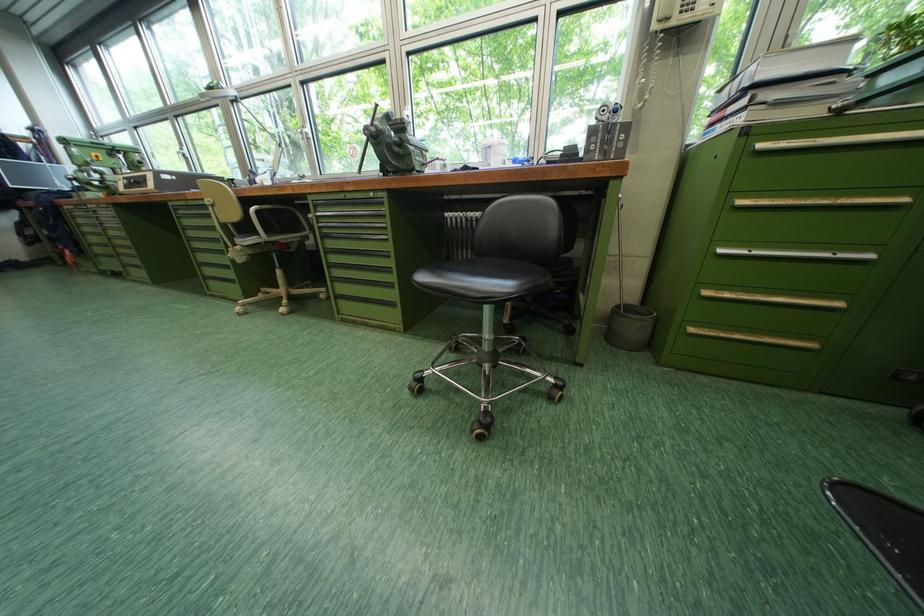
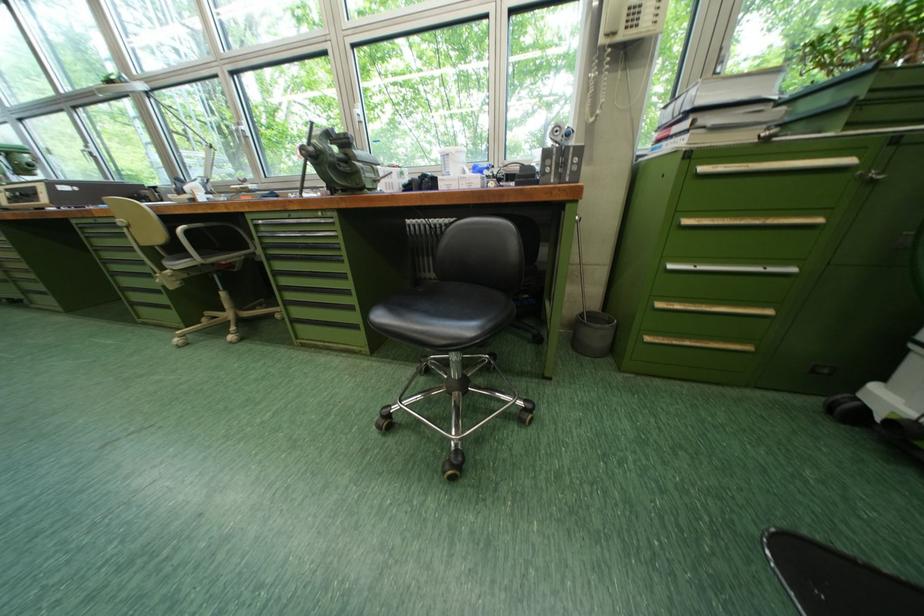
Locate, in the second image, the point that corresponds to the point at 742,113 in the first image.

(686, 132)